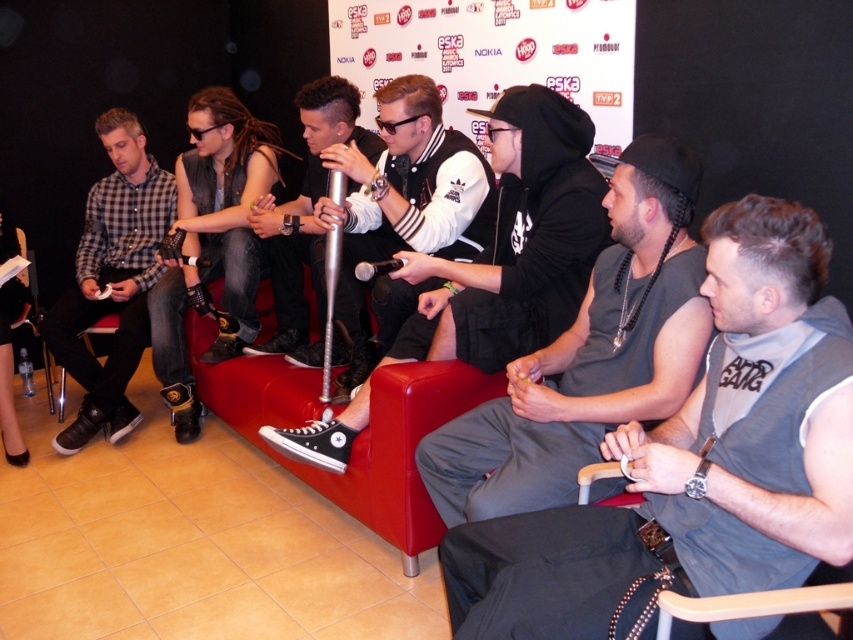
You are a photographer setting up for a group photo. You notice the white leather jacket at center and the matte black sneakers at left. Which object should you adjust to ensure both are fully visible in the frame?

The white leather jacket at center is not as tall as the matte black sneakers at left. To ensure both are fully visible, you should adjust the angle or position to accommodate the taller matte black sneakers at left.

You are a photographer positioned at the entrance of the room. You need to capture a photo that includes both the red leather couch at center and the wooden at lower right. Based on their positions, which object should you frame first to ensure both are in the shot?

The red leather couch at center is to the left of wooden at lower right, so you should frame the red leather couch at center first to ensure both are in the shot.

You are a photographer positioned in front of the scene. You need to focus your camera on the leather vest at center and the matte black sneakers at left. Which object should you adjust your focus to first if you want to capture both in a single shot?

You should focus on the leather vest at center first because it is closer to the viewer than the matte black sneakers at left, ensuring both are in focus when using a shallow depth of field.